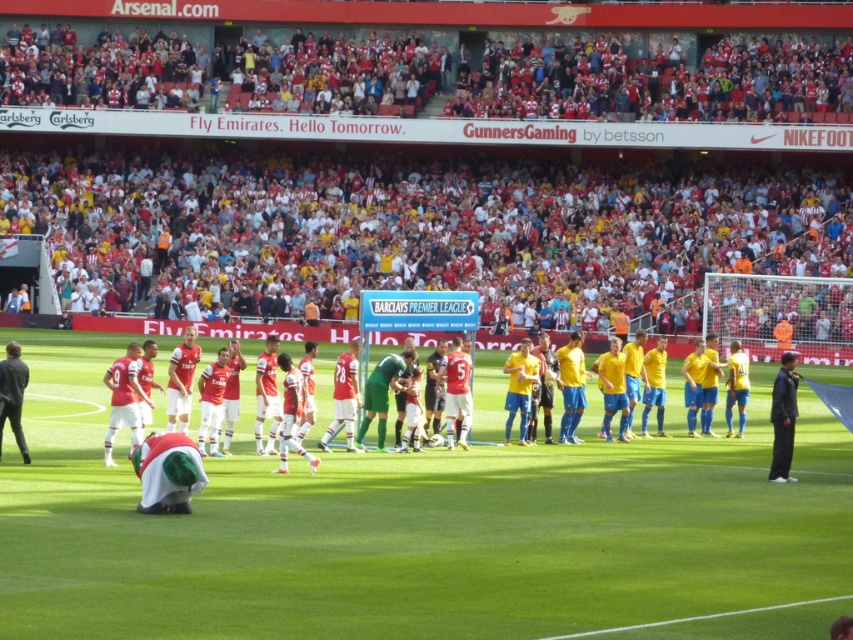
Can you confirm if dark gray jacket at right is bigger than dark gray suit at left?

No.

Which of these two, dark gray jacket at right or dark gray suit at left, stands shorter?

dark gray jacket at right is shorter.

At what (x,y) coordinates should I click in order to perform the action: click on dark gray jacket at right. Please return your answer as a coordinate pair (x, y). This screenshot has width=853, height=640. Looking at the image, I should click on (782, 417).

Does green grass field at center lie behind dark gray suit at left?

No, green grass field at center is closer to the viewer.

Does point (761, 484) come in front of point (15, 342)?

No, it is not.

Between point (28, 444) and point (6, 371), which one is positioned in front?

Point (6, 371) is in front.

Identify the location of green grass field at center. (422, 529).

Image resolution: width=853 pixels, height=640 pixels. Describe the element at coordinates (405, 230) in the screenshot. I see `red fabric crowd at upper center` at that location.

Who is more forward, (757, 234) or (788, 365)?

Point (788, 365)

Locate an element on the screen. The image size is (853, 640). red fabric crowd at upper center is located at coordinates (405, 230).

Where is `red fabric crowd at upper center`? red fabric crowd at upper center is located at coordinates (405, 230).